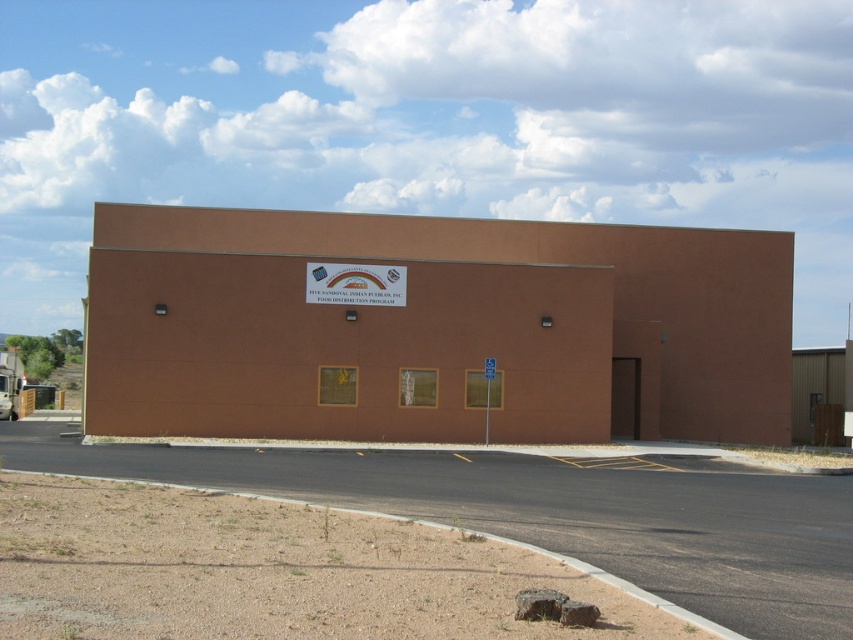
Question: Does matte brown building at center have a greater width compared to white plastic sign at center?

Choices:
 (A) no
 (B) yes

Answer: (B)

Question: Does matte brown building at center come in front of white plastic sign at center?

Choices:
 (A) yes
 (B) no

Answer: (A)

Question: Is matte brown building at center to the right of white plastic sign at center from the viewer's perspective?

Choices:
 (A) yes
 (B) no

Answer: (A)

Question: Among these objects, which one is nearest to the camera?

Choices:
 (A) matte brown building at center
 (B) white plastic sign at center

Answer: (A)